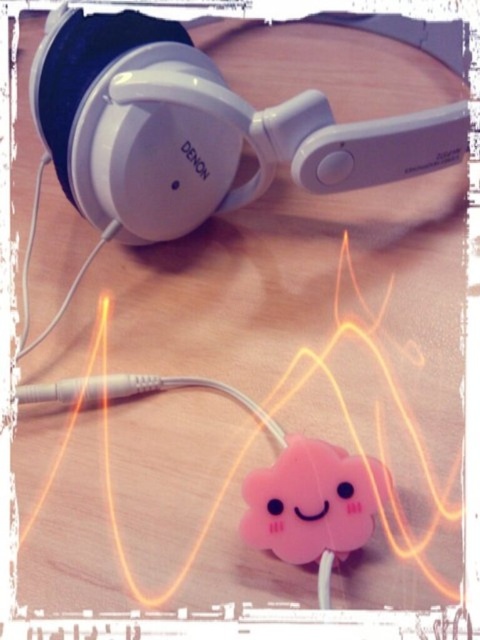
Is point (113, 52) closer to camera compared to point (342, 476)?

That is False.

Where is `white matte headphones at upper center`? white matte headphones at upper center is located at coordinates (197, 129).